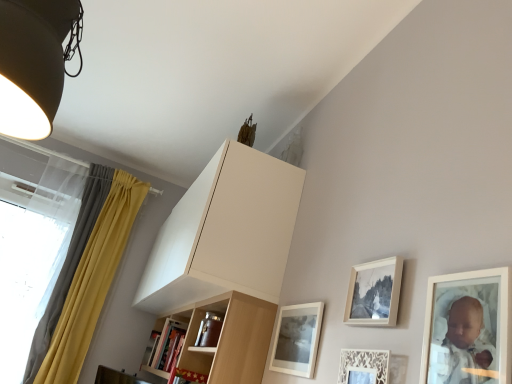
Question: From the image's perspective, does matte white picture frame at upper right, which appears as the 1th picture frame when viewed from the front, appear higher than white lace picture frame at lower right, which is counted as the 3th picture frame, starting from the back?

Choices:
 (A) no
 (B) yes

Answer: (B)

Question: From a real-world perspective, is matte white picture frame at upper right, which appears as the 1th picture frame when viewed from the front, under white lace picture frame at lower right, the 2th picture frame in the front-to-back sequence?

Choices:
 (A) yes
 (B) no

Answer: (B)

Question: Can you confirm if matte white picture frame at upper right, the fourth picture frame from the back, is thinner than white lace picture frame at lower right, the 2th picture frame in the front-to-back sequence?

Choices:
 (A) yes
 (B) no

Answer: (A)

Question: Is matte white picture frame at upper right, the fourth picture frame from the back, at the left side of white lace picture frame at lower right, the 2th picture frame in the front-to-back sequence?

Choices:
 (A) no
 (B) yes

Answer: (A)

Question: Is matte white picture frame at upper right, which appears as the 1th picture frame when viewed from the front, shorter than white lace picture frame at lower right, the 2th picture frame in the front-to-back sequence?

Choices:
 (A) yes
 (B) no

Answer: (A)

Question: Is translucent fabric at left taller or shorter than matte white picture frame at lower center, which is the first picture frame in back-to-front order?

Choices:
 (A) short
 (B) tall

Answer: (B)

Question: Is translucent fabric at left in front of or behind matte white picture frame at lower center, the 4th picture frame in the front-to-back sequence, in the image?

Choices:
 (A) behind
 (B) front

Answer: (A)

Question: From the image's perspective, is translucent fabric at left positioned above or below matte white picture frame at lower center, which is the first picture frame in back-to-front order?

Choices:
 (A) above
 (B) below

Answer: (A)

Question: Is translucent fabric at left inside or outside of matte white picture frame at lower center, the 4th picture frame in the front-to-back sequence?

Choices:
 (A) outside
 (B) inside

Answer: (A)

Question: Choose the correct answer: Is white matte cabinet at upper center inside matte white picture frame at lower center, which is the first picture frame in back-to-front order, or outside it?

Choices:
 (A) inside
 (B) outside

Answer: (B)

Question: In terms of width, does white matte cabinet at upper center look wider or thinner when compared to matte white picture frame at lower center, which is the first picture frame in back-to-front order?

Choices:
 (A) thin
 (B) wide

Answer: (B)

Question: From the image's perspective, relative to matte white picture frame at lower center, which is the first picture frame in back-to-front order, is white matte cabinet at upper center above or below?

Choices:
 (A) above
 (B) below

Answer: (A)

Question: From their relative heights in the image, would you say white matte cabinet at upper center is taller or shorter than matte white picture frame at lower center, the 4th picture frame in the front-to-back sequence?

Choices:
 (A) tall
 (B) short

Answer: (A)

Question: Looking at their shapes, would you say matte white picture frame at lower center, which is the first picture frame in back-to-front order, is wider or thinner than matte black lampshade at upper left?

Choices:
 (A) wide
 (B) thin

Answer: (B)

Question: Considering the positions of point (304, 332) and point (69, 19), is point (304, 332) closer or farther from the camera than point (69, 19)?

Choices:
 (A) closer
 (B) farther

Answer: (B)